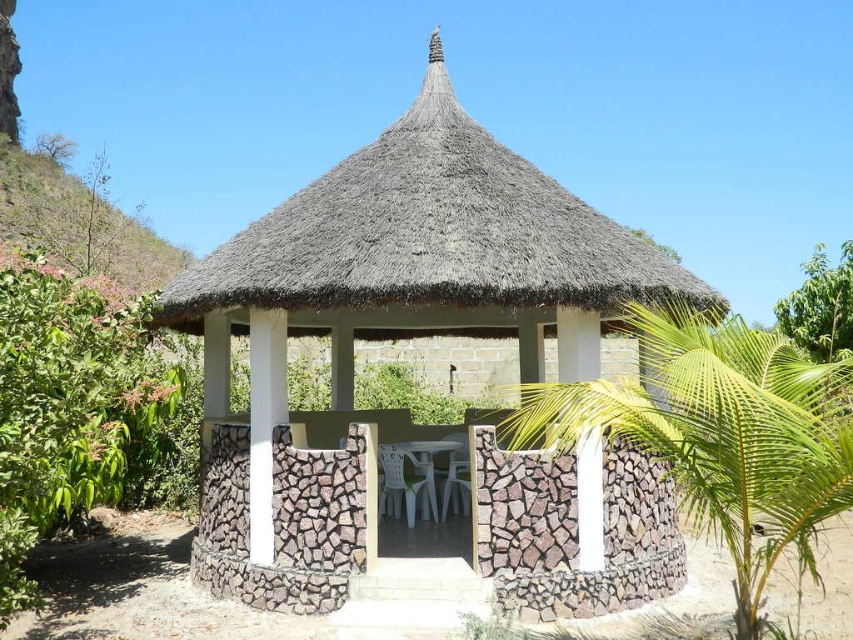
You are standing at the entrance of the thatched roof hut at center and want to see the green leafy palm tree at center. Can you see it directly from your current position inside the hut?

The thatched roof hut at center is positioned over green leafy palm tree at center, so the palm tree is likely obstructed by the hut structure. You probably cannot see the green leafy palm tree at center directly from inside the hut.

You are planning to set up a small garden between the thatched roof hut at center and the green leafy palm tree at center. What is the minimum length of the garden path you need to create to connect them?

The minimum length of the garden path needed to connect the thatched roof hut at center and the green leafy palm tree at center is 3.12 meters, as they are 3.12 meters apart.